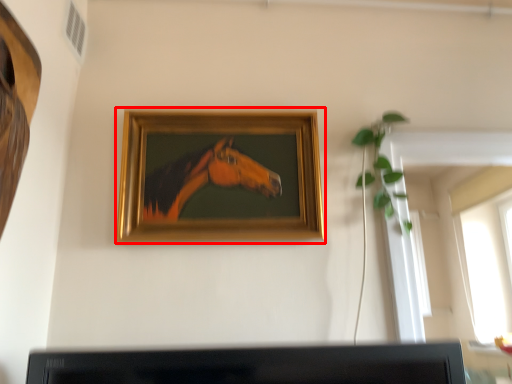
Question: Observing the image, what is the correct spatial positioning of picture frame (annotated by the red box) in reference to plant?

Choices:
 (A) right
 (B) left

Answer: (B)